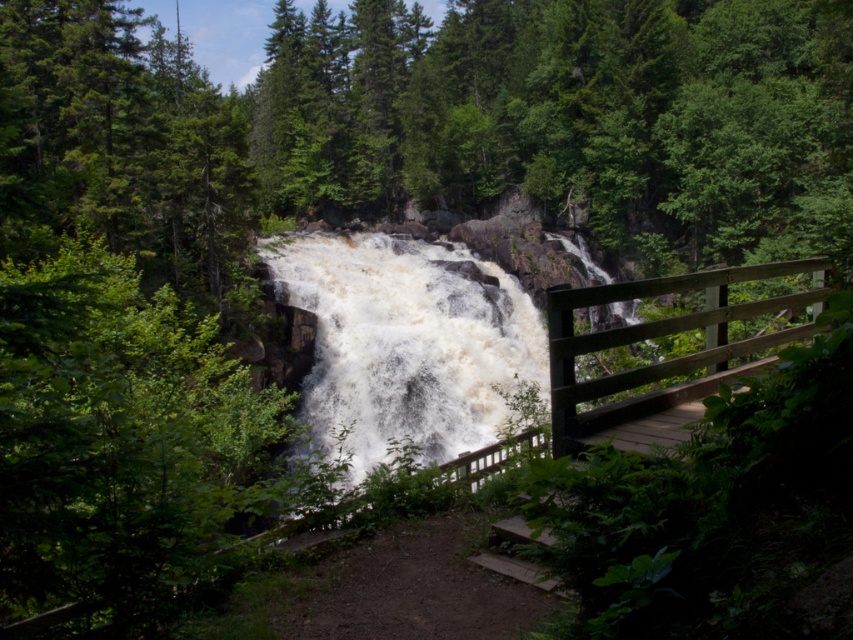
Is the position of white frothy water at center more distant than that of brown wooden rail at center right?

Yes.

Which of these two, white frothy water at center or brown wooden rail at center right, stands taller?

white frothy water at center

Which is behind, point (471, 337) or point (676, 362)?

The point (471, 337) is more distant.

Where is `white frothy water at center`? white frothy water at center is located at coordinates (405, 344).